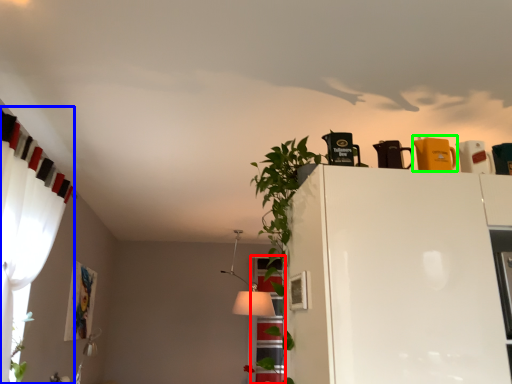
Question: Considering the real-world distances, which object is farthest from window (highlighted by a red box)? curtain (highlighted by a blue box) or appliance (highlighted by a green box)?

Choices:
 (A) curtain
 (B) appliance

Answer: (B)